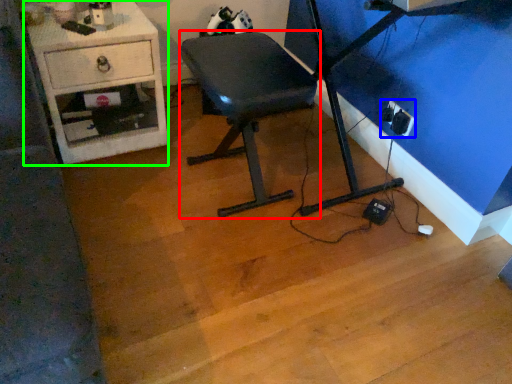
Question: Estimate the real-world distances between objects in this image. Which object is closer to furniture (highlighted by a red box), electric outlet (highlighted by a blue box) or desk (highlighted by a green box)?

Choices:
 (A) electric outlet
 (B) desk

Answer: (B)